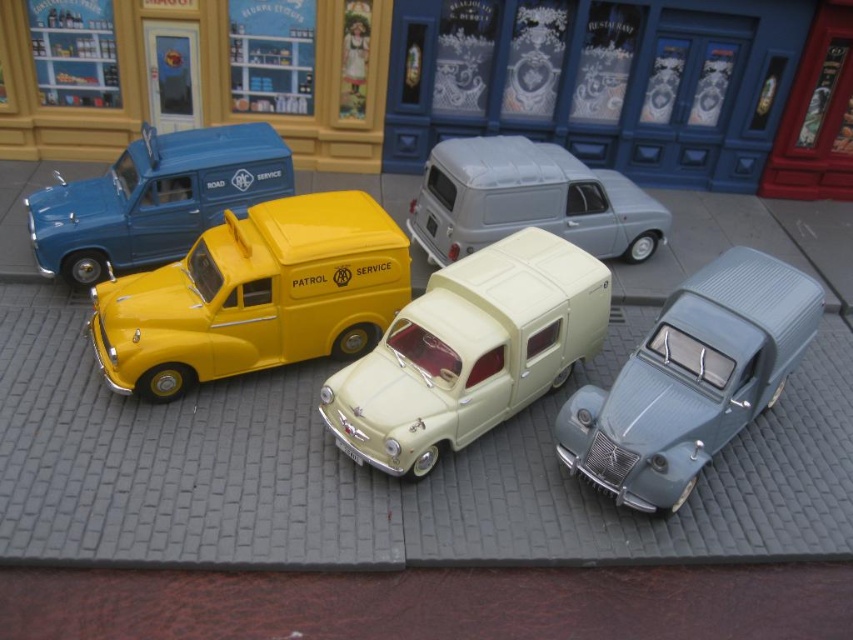
You are standing in front of a display of miniature vehicles. You see the yellow matte van at center and the matte blue van at left. Which van is closer to you?

The yellow matte van at center is closer to you because it is in front of the matte blue van at left.

Consider the image. You are a visitor at a model vehicle exhibition and want to take a photo of both the metallic blue car at lower right and the matte blue van at left. Which vehicle should you focus on first to ensure both are in frame without moving the camera?

You should focus on the matte blue van at left first because the metallic blue car at lower right is closer to the viewer, so adjusting focus to the farther object first will allow both to be in frame when refocusing towards the closer one.

In the scene with the miniature model vehicles on the paved surface, there are a yellow van labeled Patrol Service in the center left, a cream colored car with a slightly elevated rear section to its right, and a metallic blue car at lower right. Which vehicle is located at the coordinate point 0.594, 0.811?

The metallic blue car at lower right is located at the coordinate point (691,380).